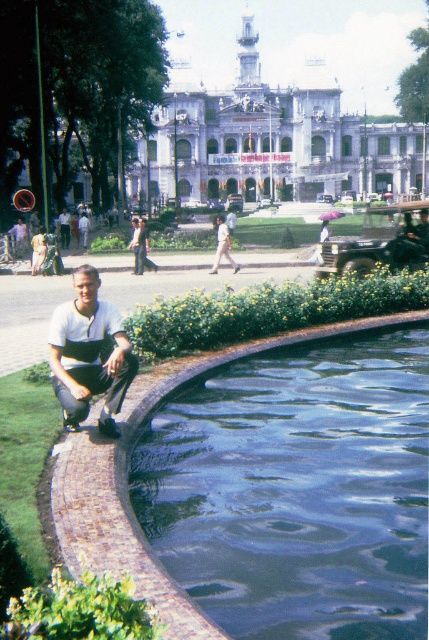
Question: Among these points, which one is nearest to the camera?

Choices:
 (A) tap(103, 332)
 (B) tap(398, 260)
 (C) tap(226, 236)

Answer: (A)

Question: Is blue polished stone pool at lower center bigger than metallic green jeep at center-right?

Choices:
 (A) yes
 (B) no

Answer: (A)

Question: Estimate the real-world distances between objects in this image. Which object is farther from the metallic green jeep at center-right?

Choices:
 (A) white stone building at center
 (B) blue polished stone pool at lower center
 (C) light beige shirt at center

Answer: (B)

Question: Is white stone building at center below metallic green jeep at center-right?

Choices:
 (A) no
 (B) yes

Answer: (A)

Question: Can you confirm if blue polished stone pool at lower center is wider than white stone building at center?

Choices:
 (A) no
 (B) yes

Answer: (A)

Question: Which point is closer to the camera?

Choices:
 (A) white cotton shirt at lower left
 (B) blue polished stone pool at lower center

Answer: (B)